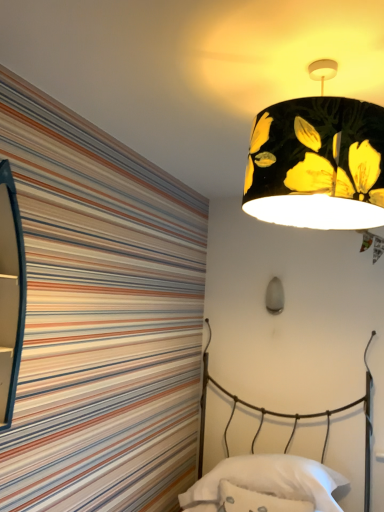
The height and width of the screenshot is (512, 384). Identify the location of white fluffy throw pillow at lower center. (256, 501).

At what (x,y) coordinates should I click in order to perform the action: click on metallic wire bed at lower right. Please return your answer as a coordinate pair (x, y). The image size is (384, 512). Looking at the image, I should click on (285, 418).

Measure the distance between point (219, 474) and camera.

They are 7.18 feet apart.

This screenshot has width=384, height=512. In order to click on black fabric lampshade at upper right, arranged as the first lamp when viewed from the front in this screenshot , I will do `click(317, 161)`.

What do you see at coordinates (317, 161) in the screenshot? This screenshot has height=512, width=384. I see `black fabric lampshade at upper right, arranged as the first lamp when viewed from the front` at bounding box center [317, 161].

Where is `matte gray bulb at center, which is the 1th lamp from bottom to top`? matte gray bulb at center, which is the 1th lamp from bottom to top is located at coordinates (274, 296).

Find the location of a particular element. Image resolution: width=384 pixels, height=512 pixels. white fluffy throw pillow at lower center is located at coordinates pyautogui.click(x=256, y=501).

Which is behind, black fabric lampshade at upper right, placed as the second lamp when sorted from back to front, or white fluffy throw pillow at lower center?

white fluffy throw pillow at lower center is behind.

Does black fabric lampshade at upper right, placed as the second lamp when sorted from back to front, have a lesser height compared to white fluffy throw pillow at lower center?

Incorrect, the height of black fabric lampshade at upper right, placed as the second lamp when sorted from back to front, does not fall short of that of white fluffy throw pillow at lower center.

In the scene shown: How distant is black fabric lampshade at upper right, arranged as the first lamp when viewed from the front, from white fluffy throw pillow at lower center?

A distance of 4.98 feet exists between black fabric lampshade at upper right, arranged as the first lamp when viewed from the front, and white fluffy throw pillow at lower center.

Find the location of a particular element. This screenshot has width=384, height=512. throw pillow located underneath the black fabric lampshade at upper right, the first lamp from the top (from a real-world perspective) is located at coordinates (256, 501).

Between black fabric lampshade at upper right, placed as the second lamp when sorted from back to front, and matte gray bulb at center, the second lamp positioned from the top, which one appears on the right side from the viewer's perspective?

From the viewer's perspective, matte gray bulb at center, the second lamp positioned from the top, appears more on the right side.

Is black fabric lampshade at upper right, the first lamp from the top, beside matte gray bulb at center, which is the 1th lamp from bottom to top?

No, black fabric lampshade at upper right, the first lamp from the top, is not with matte gray bulb at center, which is the 1th lamp from bottom to top.

Between black fabric lampshade at upper right, placed as the second lamp when sorted from back to front, and matte gray bulb at center, acting as the first lamp starting from the back, which one has less height?

With less height is matte gray bulb at center, acting as the first lamp starting from the back.

Is matte gray bulb at center, acting as the first lamp starting from the back, located within black fabric lampshade at upper right, arranged as the first lamp when viewed from the front?

No, black fabric lampshade at upper right, arranged as the first lamp when viewed from the front, does not contain matte gray bulb at center, acting as the first lamp starting from the back.

From the picture: How much distance is there between white soft pillow at lower center and black fabric lampshade at upper right, arranged as the first lamp when viewed from the front?

white soft pillow at lower center and black fabric lampshade at upper right, arranged as the first lamp when viewed from the front, are 4.95 feet apart from each other.

Does white soft pillow at lower center turn towards black fabric lampshade at upper right, arranged as the first lamp when viewed from the front?

No, white soft pillow at lower center does not turn towards black fabric lampshade at upper right, arranged as the first lamp when viewed from the front.

Is there a large distance between white soft pillow at lower center and black fabric lampshade at upper right, the 2th lamp in the bottom-to-top sequence?

Yes, white soft pillow at lower center is far from black fabric lampshade at upper right, the 2th lamp in the bottom-to-top sequence.

Does white soft pillow at lower center appear on the right side of black fabric lampshade at upper right, the first lamp from the top?

Correct, you'll find white soft pillow at lower center to the right of black fabric lampshade at upper right, the first lamp from the top.

Considering their positions, is matte gray bulb at center, the second lamp positioned from the top, located in front of or behind metallic wire bed at lower right?

matte gray bulb at center, the second lamp positioned from the top, is behind metallic wire bed at lower right.

From a real-world perspective, is matte gray bulb at center, the second lamp positioned from the top, on top of metallic wire bed at lower right?

Correct, in the physical world, matte gray bulb at center, the second lamp positioned from the top, is higher than metallic wire bed at lower right.

Identify the location of bed below the matte gray bulb at center, the second lamp from the front (from a real-world perspective). This screenshot has height=512, width=384. (285, 418).

Can you confirm if matte gray bulb at center, which is the 1th lamp from bottom to top, is positioned to the right of metallic wire bed at lower right?

Yes, matte gray bulb at center, which is the 1th lamp from bottom to top, is to the right of metallic wire bed at lower right.

Is metallic wire bed at lower right facing away from matte gray bulb at center, which is the 1th lamp from bottom to top?

No, matte gray bulb at center, which is the 1th lamp from bottom to top, is not at the back of metallic wire bed at lower right.

The width and height of the screenshot is (384, 512). Find the location of `bed below the matte gray bulb at center, which is the 1th lamp from bottom to top (from the image's perspective)`. bed below the matte gray bulb at center, which is the 1th lamp from bottom to top (from the image's perspective) is located at coordinates (285, 418).

In terms of size, does metallic wire bed at lower right appear bigger or smaller than matte gray bulb at center, which is the 1th lamp from bottom to top?

metallic wire bed at lower right is bigger than matte gray bulb at center, which is the 1th lamp from bottom to top.

Is white soft pillow at lower center looking in the opposite direction of matte gray bulb at center, acting as the first lamp starting from the back?

No, white soft pillow at lower center is not facing the opposite direction of matte gray bulb at center, acting as the first lamp starting from the back.

Considering the sizes of white soft pillow at lower center and matte gray bulb at center, which is the 1th lamp from bottom to top, in the image, is white soft pillow at lower center wider or thinner than matte gray bulb at center, which is the 1th lamp from bottom to top,?

Considering their sizes, white soft pillow at lower center looks broader than matte gray bulb at center, which is the 1th lamp from bottom to top.

Which object is closer to the camera, white soft pillow at lower center or matte gray bulb at center, the second lamp from the front?

white soft pillow at lower center is in front.

From a real-world perspective, is white soft pillow at lower center positioned under matte gray bulb at center, the second lamp positioned from the top, based on gravity?

Yes.

From the image's perspective, is metallic wire bed at lower right above or below white fluffy throw pillow at lower center?

metallic wire bed at lower right is situated higher than white fluffy throw pillow at lower center in the image.

Which is closer, (369, 386) or (234, 486)?

Point (369, 386) is farther from the camera than point (234, 486).

Choose the correct answer: Is metallic wire bed at lower right inside white fluffy throw pillow at lower center or outside it?

metallic wire bed at lower right exists outside the volume of white fluffy throw pillow at lower center.

Can you confirm if metallic wire bed at lower right is smaller than white fluffy throw pillow at lower center?

Incorrect, metallic wire bed at lower right is not smaller in size than white fluffy throw pillow at lower center.

You are a GUI agent. You are given a task and a screenshot of the screen. Output one action in this format:
    pyautogui.click(x=<x>, y=<y>)
    Task: Click on the lamp in front of the white fluffy throw pillow at lower center
    This screenshot has width=384, height=512.
    Given the screenshot: What is the action you would take?
    pyautogui.click(x=317, y=161)

At what (x,y) coordinates should I click in order to perform the action: click on lamp below the black fabric lampshade at upper right, placed as the second lamp when sorted from back to front (from a real-world perspective). Please return your answer as a coordinate pair (x, y). This screenshot has width=384, height=512. Looking at the image, I should click on (274, 296).

Looking at this image, from the image, which object appears to be farther from white fluffy throw pillow at lower center, matte gray bulb at center, the second lamp positioned from the top, or metallic wire bed at lower right?

matte gray bulb at center, the second lamp positioned from the top, is further to white fluffy throw pillow at lower center.

Looking at the image, which one is located further to matte gray bulb at center, the second lamp positioned from the top, white fluffy throw pillow at lower center or black fabric lampshade at upper right, placed as the second lamp when sorted from back to front?

black fabric lampshade at upper right, placed as the second lamp when sorted from back to front, is positioned further to the anchor matte gray bulb at center, the second lamp positioned from the top.

Considering their positions, is white soft pillow at lower center positioned further to white fluffy throw pillow at lower center than black fabric lampshade at upper right, arranged as the first lamp when viewed from the front?

The object further to white fluffy throw pillow at lower center is black fabric lampshade at upper right, arranged as the first lamp when viewed from the front.

Looking at the image, which one is located closer to black fabric lampshade at upper right, the 2th lamp in the bottom-to-top sequence, metallic wire bed at lower right or white soft pillow at lower center?

white soft pillow at lower center.

When comparing their distances from metallic wire bed at lower right, does white soft pillow at lower center or black fabric lampshade at upper right, the 2th lamp in the bottom-to-top sequence, seem further?

black fabric lampshade at upper right, the 2th lamp in the bottom-to-top sequence, is positioned further to the anchor metallic wire bed at lower right.

Based on their spatial positions, is black fabric lampshade at upper right, the 2th lamp in the bottom-to-top sequence, or white fluffy throw pillow at lower center further from matte gray bulb at center, which is the 1th lamp from bottom to top?

Among the two, black fabric lampshade at upper right, the 2th lamp in the bottom-to-top sequence, is located further to matte gray bulb at center, which is the 1th lamp from bottom to top.

Based on their spatial positions, is white fluffy throw pillow at lower center or white soft pillow at lower center closer to metallic wire bed at lower right?

Based on the image, white soft pillow at lower center appears to be nearer to metallic wire bed at lower right.

Which object lies further to the anchor point white fluffy throw pillow at lower center, metallic wire bed at lower right or matte gray bulb at center, the second lamp from the front?

The object further to white fluffy throw pillow at lower center is matte gray bulb at center, the second lamp from the front.

The image size is (384, 512). Identify the location of pillow between metallic wire bed at lower right and matte gray bulb at center, the second lamp positioned from the top, in the front-back direction. (270, 479).

Where is `lamp between black fabric lampshade at upper right, arranged as the first lamp when viewed from the front, and white soft pillow at lower center from top to bottom`? The height and width of the screenshot is (512, 384). lamp between black fabric lampshade at upper right, arranged as the first lamp when viewed from the front, and white soft pillow at lower center from top to bottom is located at coordinates (274, 296).

In order to click on throw pillow between metallic wire bed at lower right and matte gray bulb at center, which is the 1th lamp from bottom to top, along the z-axis in this screenshot , I will do [x=256, y=501].

The width and height of the screenshot is (384, 512). I want to click on bed between black fabric lampshade at upper right, the first lamp from the top, and white fluffy throw pillow at lower center vertically, so click(285, 418).